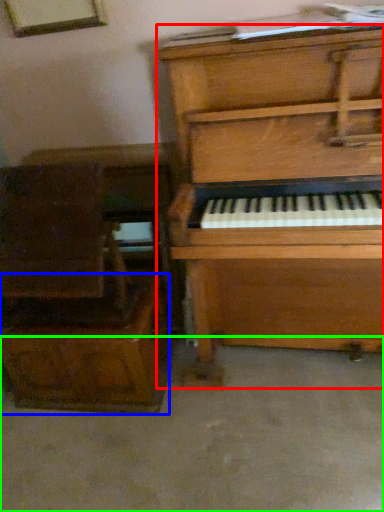
Question: Which object is positioned farthest from piano (highlighted by a red box)? Select from drawer (highlighted by a blue box) and concrete (highlighted by a green box).

Choices:
 (A) drawer
 (B) concrete

Answer: (B)